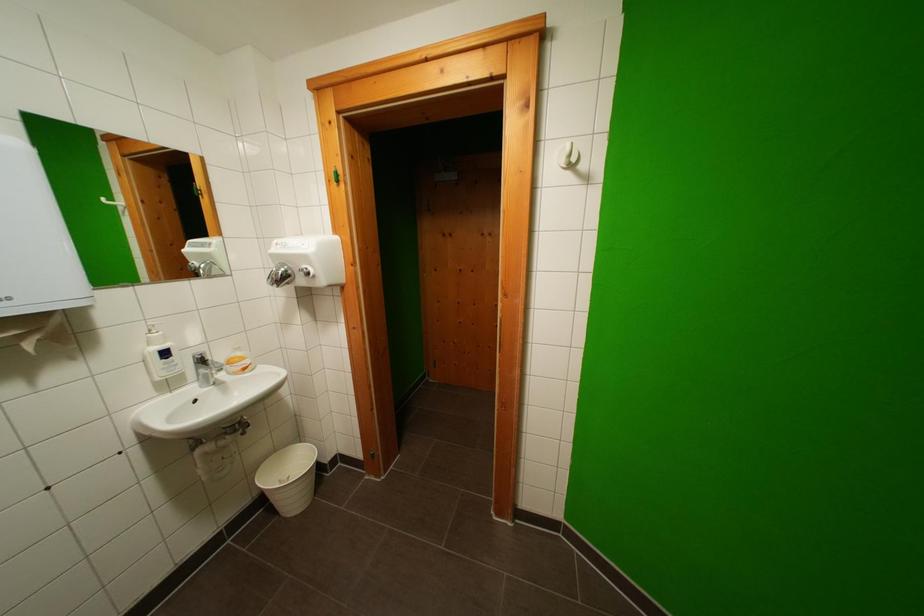
Image resolution: width=924 pixels, height=616 pixels. I want to click on soap dispenser pump, so click(x=154, y=325).